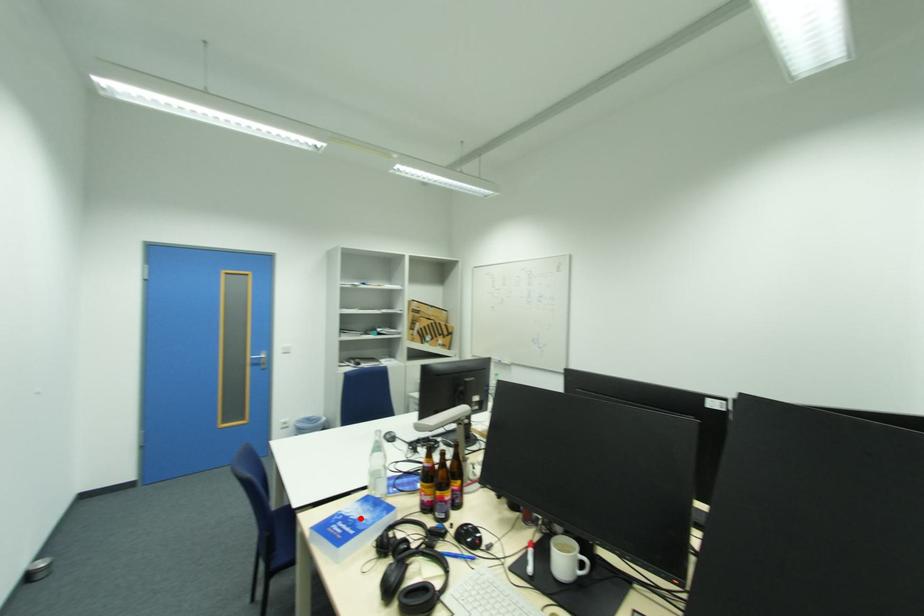
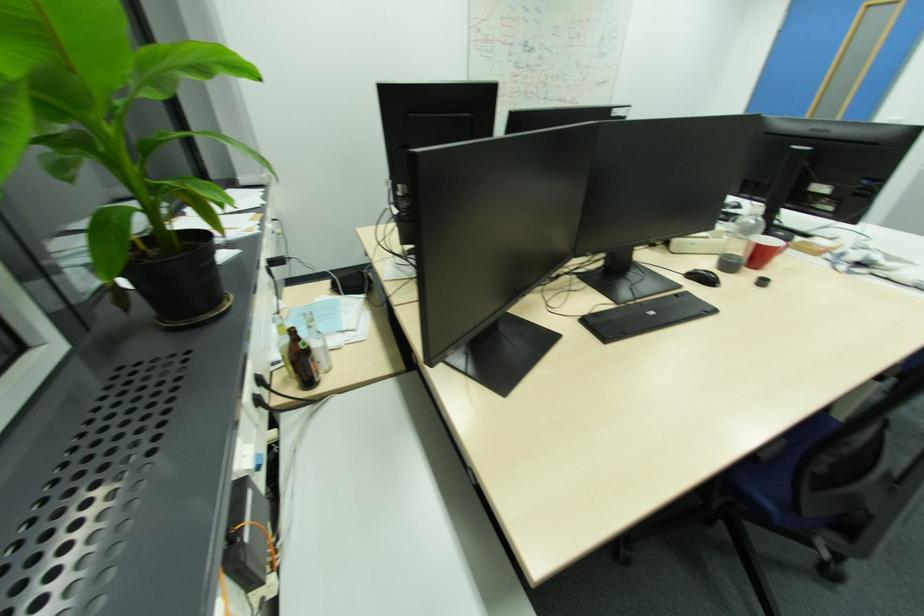
Question: I am providing you with two images of the same scene from different viewpoints. A red point is marked on the first image. At the location where the point appears in image 1, is it still visible in image 2?

Choices:
 (A) Yes
 (B) No

Answer: (B)